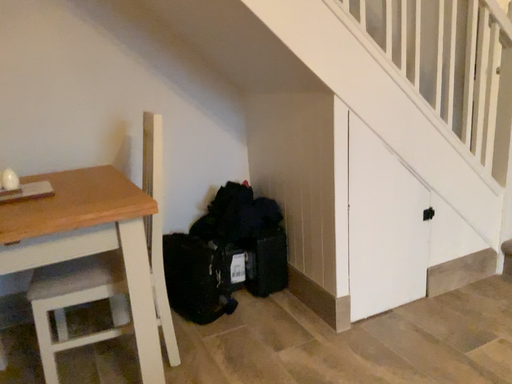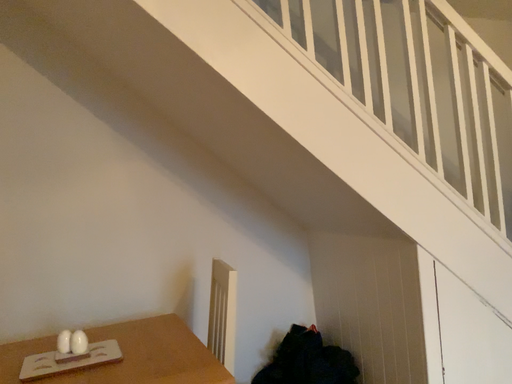
Question: How did the camera likely rotate when shooting the video?

Choices:
 (A) rotated downward
 (B) rotated upward

Answer: (B)